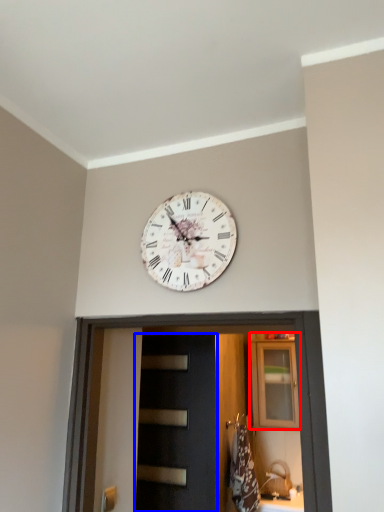
Question: Which object appears farthest to the camera in this image, cabinetry (highlighted by a red box) or door (highlighted by a blue box)?

Choices:
 (A) cabinetry
 (B) door

Answer: (A)